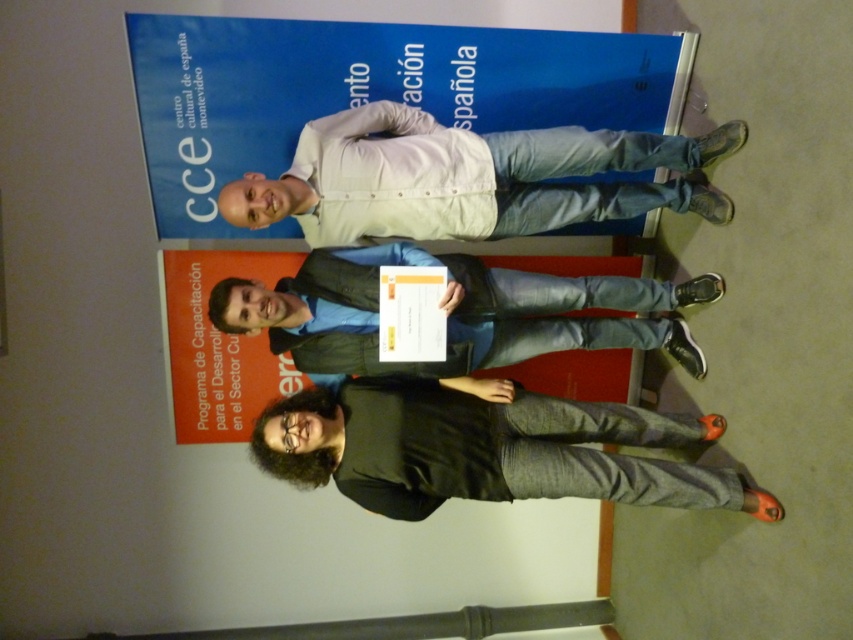
Can you confirm if dark gray cotton pants at lower center is shorter than white matte shirt at center?

Indeed, dark gray cotton pants at lower center has a lesser height compared to white matte shirt at center.

Based on the photo, between dark gray cotton pants at lower center and white matte shirt at center, which one has less height?

With less height is dark gray cotton pants at lower center.

Does point (770, 515) come in front of point (668, 140)?

Yes, it is in front of point (668, 140).

This screenshot has height=640, width=853. I want to click on dark gray cotton pants at lower center, so pos(486,451).

Does blue paper at upper center appear over dark gray cotton pants at lower center?

Correct, blue paper at upper center is located above dark gray cotton pants at lower center.

Is point (323, 54) farther from camera compared to point (709, 426)?

That is False.

Between point (421, 28) and point (490, 417), which one is positioned in front?

Point (490, 417) is in front.

The height and width of the screenshot is (640, 853). In order to click on blue paper at upper center in this screenshot , I will do coord(367,92).

What do you see at coordinates (461, 177) in the screenshot? I see `white matte shirt at center` at bounding box center [461, 177].

Is white matte shirt at center shorter than matte black shirt at center?

No, white matte shirt at center is not shorter than matte black shirt at center.

Measure the distance between point (450, 172) and camera.

Point (450, 172) and camera are 7.83 feet apart.

I want to click on white matte shirt at center, so click(x=461, y=177).